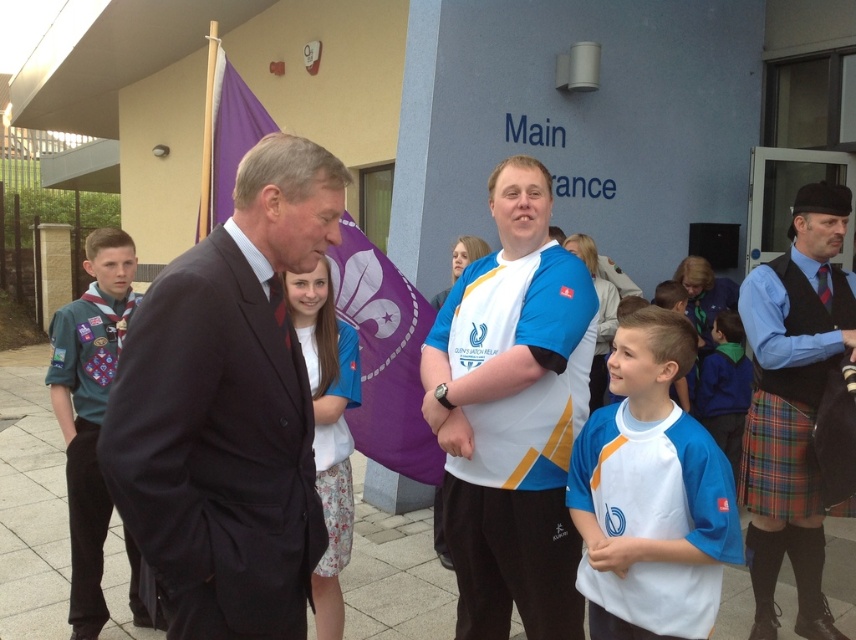
You are a photographer at the event and need to capture a photo of both the white matte shirt at center and the black wool vest at right in the same frame. Your camera has a minimum focus distance of 1.2 meters. Can you take the photo without moving either subject?

The white matte shirt at center and black wool vest at right are 1.30 meters apart. Since the distance between them is greater than the camera minimum focus distance of 1.2 meters, you can take the photo without moving either subject.

Consider the image. You are organizing a group photo and need to arrange two individuals based on their clothing dimensions. The white matte shirt at center and the black wool vest at right are the subjects. Which clothing item has a greater width?

The black wool vest at right has a greater width than the white matte shirt at center according to the description.

You are standing at the point marked by the coordinates point (512, 416). Looking around, you see a young boy in a scout uniform. Where is the young boy in a scout uniform relative to your position?

The young boy in a scout uniform is to the left of point (512, 416).